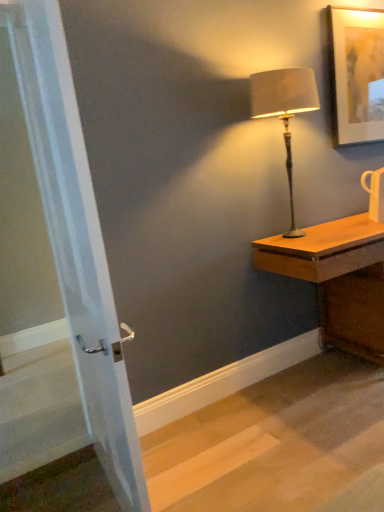
This screenshot has width=384, height=512. Describe the element at coordinates (375, 193) in the screenshot. I see `white glossy mug at upper right` at that location.

Consider the image. Measure the distance between point (373, 183) and camera.

The depth of point (373, 183) is 7.69 feet.

Identify the location of matte white picture frame at upper right. (355, 73).

The height and width of the screenshot is (512, 384). What do you see at coordinates (337, 279) in the screenshot? I see `wooden desk at right` at bounding box center [337, 279].

What are the coordinates of `satin beige lampshade at right` in the screenshot? It's located at (284, 109).

At what (x,y) coordinates should I click in order to perform the action: click on white glossy screen door at left. Please return your answer as a coordinate pair (x, y). Image resolution: width=384 pixels, height=512 pixels. Looking at the image, I should click on (76, 240).

Identify the location of lamp that is on the right side of white glossy screen door at left. The height and width of the screenshot is (512, 384). (284, 109).

How far apart are satin beige lampshade at right and white glossy screen door at left?

They are 4.03 feet apart.

Is satin beige lampshade at right bigger than white glossy screen door at left?

Incorrect, satin beige lampshade at right is not larger than white glossy screen door at left.

From a real-world perspective, who is located lower, satin beige lampshade at right or white glossy screen door at left?

In real-world perspective, white glossy screen door at left is lower.

Identify the location of screen door below the white glossy mug at upper right (from a real-world perspective). The width and height of the screenshot is (384, 512). (76, 240).

Is white glossy mug at upper right facing away from white glossy screen door at left?

No, white glossy mug at upper right's orientation is not away from white glossy screen door at left.

Considering the relative sizes of white glossy mug at upper right and white glossy screen door at left in the image provided, is white glossy mug at upper right thinner than white glossy screen door at left?

No.

Can we say white glossy mug at upper right lies outside white glossy screen door at left?

Yes, white glossy mug at upper right is outside of white glossy screen door at left.

From a real-world perspective, is white glossy screen door at left positioned over wooden desk at right based on gravity?

Yes, from a real-world perspective, white glossy screen door at left is above wooden desk at right.

Is white glossy screen door at left positioned behind wooden desk at right?

No, the depth of white glossy screen door at left is less than that of wooden desk at right.

Where is `screen door lying above the wooden desk at right (from the image's perspective)`? The height and width of the screenshot is (512, 384). screen door lying above the wooden desk at right (from the image's perspective) is located at coordinates (76, 240).

Considering the sizes of objects white glossy screen door at left and wooden desk at right in the image provided, who is bigger, white glossy screen door at left or wooden desk at right?

wooden desk at right is bigger.

Is white glossy screen door at left oriented away from matte white picture frame at upper right?

Yes.

From the image's perspective, is white glossy screen door at left on top of matte white picture frame at upper right?

Incorrect, from the image's perspective, white glossy screen door at left is lower than matte white picture frame at upper right.

Is white glossy screen door at left closer to camera compared to matte white picture frame at upper right?

Yes, it is.

In terms of height, does white glossy screen door at left look taller or shorter compared to matte white picture frame at upper right?

Considering their sizes, white glossy screen door at left has more height than matte white picture frame at upper right.

Does point (307, 275) come in front of point (369, 190)?

Yes, point (307, 275) is closer to viewer.

Can you confirm if wooden desk at right is taller than white glossy mug at upper right?

Yes, wooden desk at right is taller than white glossy mug at upper right.

Between wooden desk at right and white glossy mug at upper right, which one appears on the right side from the viewer's perspective?

white glossy mug at upper right.

Can you tell me how much wooden desk at right and white glossy mug at upper right differ in facing direction?

The facing directions of wooden desk at right and white glossy mug at upper right are 2.11 degrees apart.

What's the angular difference between matte white picture frame at upper right and white glossy mug at upper right's facing directions?

The angle between the facing direction of matte white picture frame at upper right and the facing direction of white glossy mug at upper right is 2.89 degrees.

Is matte white picture frame at upper right far away from white glossy mug at upper right?

That's not correct — matte white picture frame at upper right is a little close to white glossy mug at upper right.

In the image, is matte white picture frame at upper right on the left side or the right side of white glossy mug at upper right?

matte white picture frame at upper right is to the left of white glossy mug at upper right.

Where is `mug below the matte white picture frame at upper right (from a real-world perspective)`? This screenshot has height=512, width=384. mug below the matte white picture frame at upper right (from a real-world perspective) is located at coordinates (375, 193).

Is white glossy mug at upper right oriented away from satin beige lampshade at right?

That's not correct — white glossy mug at upper right is not looking away from satin beige lampshade at right.

Locate an element on the screen. The width and height of the screenshot is (384, 512). mug on the right of satin beige lampshade at right is located at coordinates (375, 193).

How different are the orientations of white glossy mug at upper right and satin beige lampshade at right in degrees?

There is a 4.09-degree angle between the facing directions of white glossy mug at upper right and satin beige lampshade at right.

Looking at this image, which object is further away from the camera, white glossy mug at upper right or satin beige lampshade at right?

white glossy mug at upper right.

Locate an element on the screen. lamp that appears behind the white glossy screen door at left is located at coordinates (284, 109).

Image resolution: width=384 pixels, height=512 pixels. In order to click on mug that appears above the white glossy screen door at left (from the image's perspective) in this screenshot , I will do `click(375, 193)`.

Based on their spatial positions, is matte white picture frame at upper right or satin beige lampshade at right further from wooden desk at right?

Among the two, matte white picture frame at upper right is located further to wooden desk at right.

Looking at the image, which one is located closer to wooden desk at right, white glossy mug at upper right or matte white picture frame at upper right?

white glossy mug at upper right is positioned closer to the anchor wooden desk at right.

Which object lies further to the anchor point white glossy mug at upper right, wooden desk at right or satin beige lampshade at right?

Among the two, satin beige lampshade at right is located further to white glossy mug at upper right.

From the image, which object appears to be nearer to white glossy mug at upper right, wooden desk at right or white glossy screen door at left?

wooden desk at right lies closer to white glossy mug at upper right than the other object.

Which object lies further to the anchor point matte white picture frame at upper right, white glossy mug at upper right or satin beige lampshade at right?

Based on the image, white glossy mug at upper right appears to be further to matte white picture frame at upper right.

Which object lies further to the anchor point satin beige lampshade at right, matte white picture frame at upper right or white glossy screen door at left?

The object further to satin beige lampshade at right is white glossy screen door at left.

Based on their spatial positions, is matte white picture frame at upper right or white glossy screen door at left further from white glossy mug at upper right?

Based on the image, white glossy screen door at left appears to be further to white glossy mug at upper right.

From the image, which object appears to be nearer to matte white picture frame at upper right, white glossy mug at upper right or white glossy screen door at left?

Based on the image, white glossy mug at upper right appears to be nearer to matte white picture frame at upper right.

Where is `lamp between white glossy screen door at left and white glossy mug at upper right from front to back`? Image resolution: width=384 pixels, height=512 pixels. lamp between white glossy screen door at left and white glossy mug at upper right from front to back is located at coordinates (284, 109).

Locate an element on the screen. The width and height of the screenshot is (384, 512). desk between white glossy screen door at left and white glossy mug at upper right from left to right is located at coordinates pos(337,279).

Image resolution: width=384 pixels, height=512 pixels. I want to click on desk between white glossy screen door at left and matte white picture frame at upper right in the horizontal direction, so click(x=337, y=279).

The height and width of the screenshot is (512, 384). In order to click on mug between matte white picture frame at upper right and wooden desk at right from top to bottom in this screenshot , I will do `click(375, 193)`.